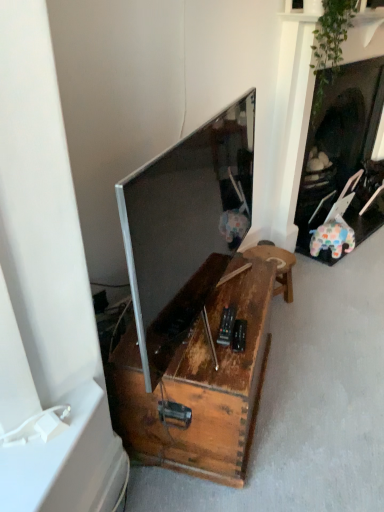
Question: From the image's perspective, is rusty wood table at center on top of satin silver television at center?

Choices:
 (A) yes
 (B) no

Answer: (B)

Question: From the image's perspective, is rusty wood table at center under satin silver television at center?

Choices:
 (A) no
 (B) yes

Answer: (B)

Question: Is rusty wood table at center bigger than satin silver television at center?

Choices:
 (A) no
 (B) yes

Answer: (B)

Question: Is rusty wood table at center at the right side of satin silver television at center?

Choices:
 (A) yes
 (B) no

Answer: (B)

Question: Would you say satin silver television at center is part of rusty wood table at center's contents?

Choices:
 (A) no
 (B) yes

Answer: (A)

Question: Is rusty wood table at center wider than satin silver television at center?

Choices:
 (A) no
 (B) yes

Answer: (B)

Question: Considering the relative sizes of satin silver television at center and rusty wood table at center in the image provided, is satin silver television at center smaller than rusty wood table at center?

Choices:
 (A) no
 (B) yes

Answer: (B)

Question: From the image's perspective, does satin silver television at center appear lower than rusty wood table at center?

Choices:
 (A) no
 (B) yes

Answer: (A)

Question: Is rusty wood table at center located within satin silver television at center?

Choices:
 (A) yes
 (B) no

Answer: (B)

Question: Is satin silver television at center aimed at rusty wood table at center?

Choices:
 (A) yes
 (B) no

Answer: (B)

Question: Are satin silver television at center and rusty wood table at center located far from each other?

Choices:
 (A) no
 (B) yes

Answer: (A)

Question: Is satin silver television at center thinner than rusty wood table at center?

Choices:
 (A) yes
 (B) no

Answer: (A)

Question: Does satin silver television at center come in front of rustic wood stool at lower center?

Choices:
 (A) yes
 (B) no

Answer: (A)